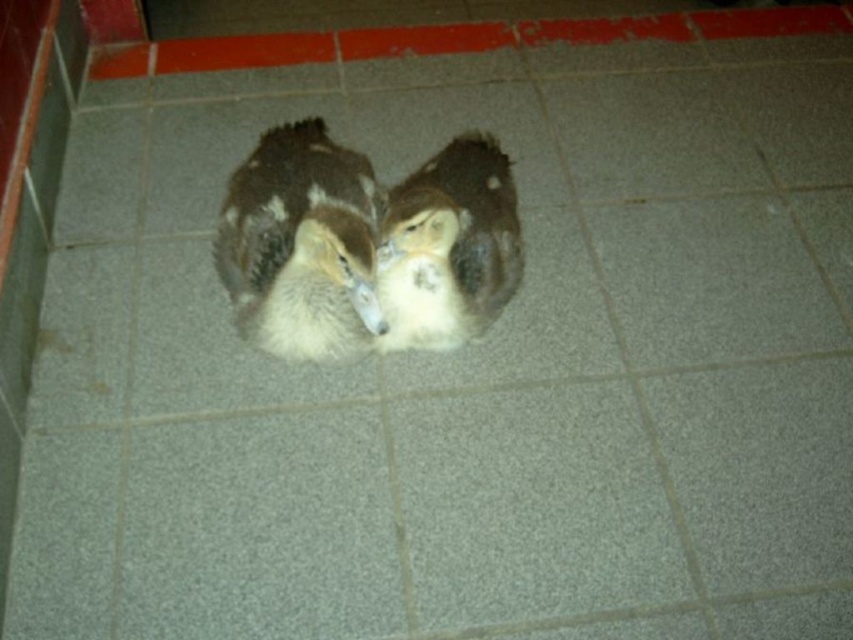
Where is `brown fuzzy duck at center`? brown fuzzy duck at center is located at coordinates (300, 244).

Does point (340, 240) lie behind point (448, 195)?

That is False.

You are a GUI agent. You are given a task and a screenshot of the screen. Output one action in this format:
    pyautogui.click(x=<x>, y=<y>)
    Task: Click on the brown fuzzy duck at center
    
    Given the screenshot: What is the action you would take?
    pyautogui.click(x=300, y=244)

Image resolution: width=853 pixels, height=640 pixels. I want to click on brown fuzzy duck at center, so click(300, 244).